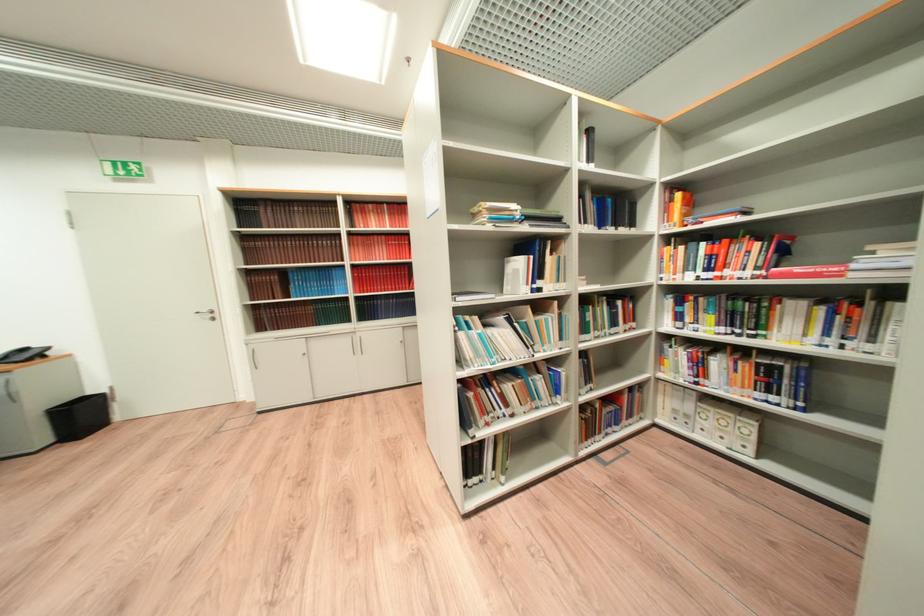
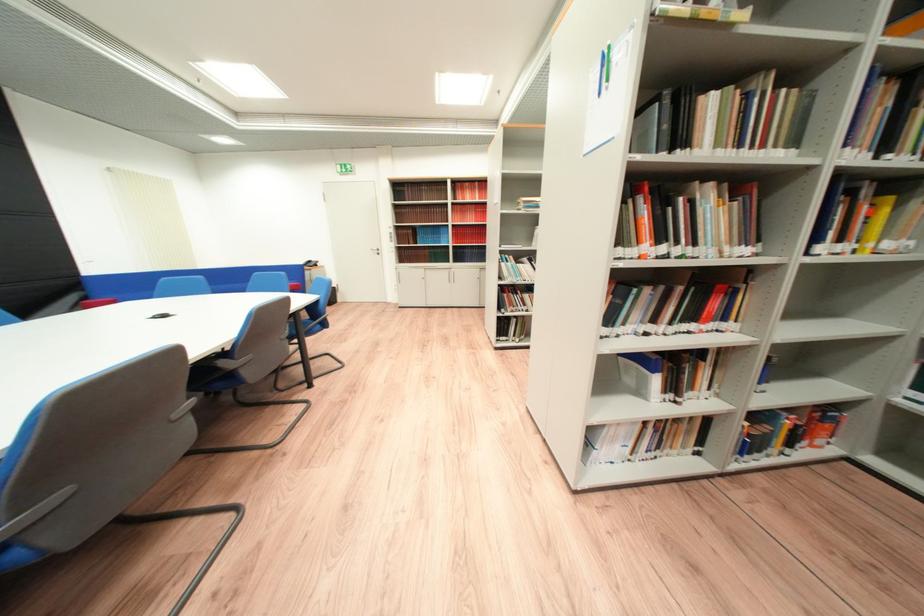
In the second image, find the point that corresponds to (x=224, y=320) in the first image.

(388, 254)